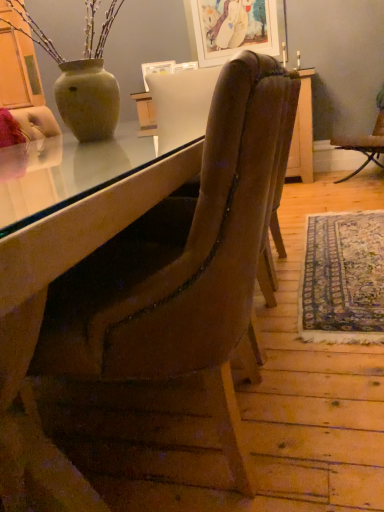
Locate an element on the screen. The width and height of the screenshot is (384, 512). empty space that is ontop of blue patterned rug at lower right (from a real-world perspective) is located at coordinates (349, 263).